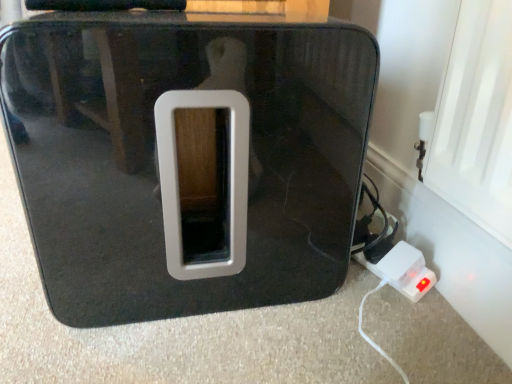
Identify the location of glossy black mini fridge at center. (157, 157).

Image resolution: width=512 pixels, height=384 pixels. Describe the element at coordinates (157, 157) in the screenshot. I see `glossy black mini fridge at center` at that location.

Find the location of a particular element. The height and width of the screenshot is (384, 512). glossy black mini fridge at center is located at coordinates (157, 157).